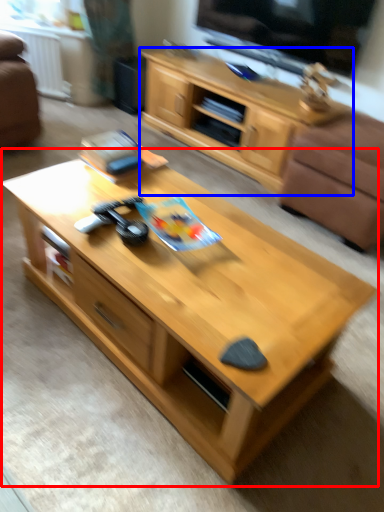
Question: Which of the following is the closest to the observer, coffee table (highlighted by a red box) or cabinetry (highlighted by a blue box)?

Choices:
 (A) coffee table
 (B) cabinetry

Answer: (A)